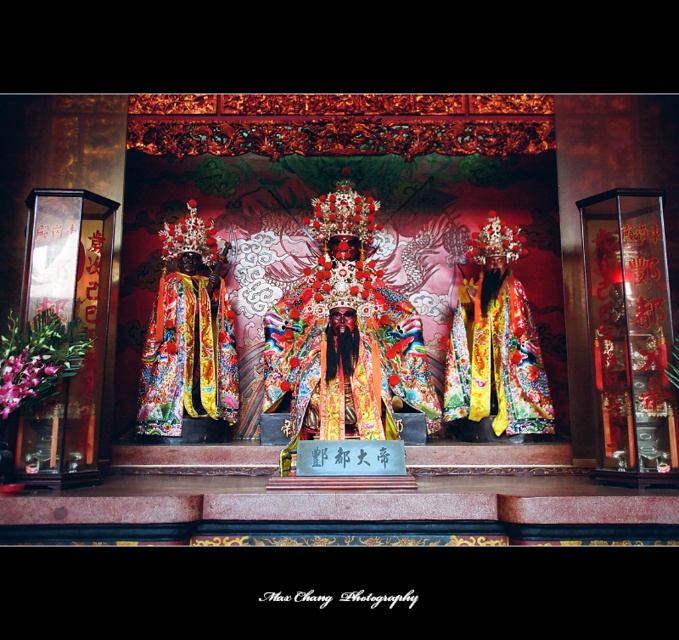
You are an artist sketching the altar scene. You need to draw the matte gold costume at center and the matte gold crown at center accurately. According to the scene, which object is positioned to the right of the other?

The matte gold costume at center is to the right of the matte gold crown at center.

You are a visitor to the temple and want to take a photo of the altar. You notice the pink silk flower at lower left and the shiny red flower at center. Which flower is positioned closer to you, the visitor?

The pink silk flower at lower left is closer to the viewer than the shiny red flower at center.